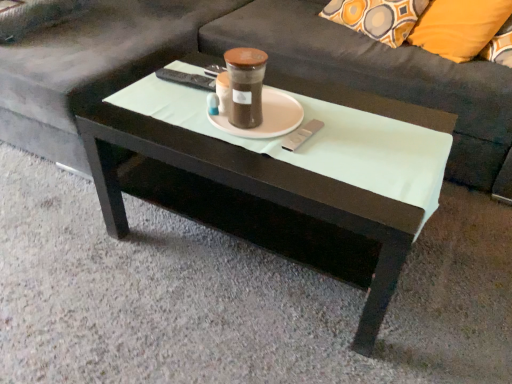
Question: Considering the positions of orange fabric pillow at upper right and white glossy coffee table at center in the image, is orange fabric pillow at upper right wider or thinner than white glossy coffee table at center?

Choices:
 (A) wide
 (B) thin

Answer: (B)

Question: In terms of height, does orange fabric pillow at upper right look taller or shorter compared to white glossy coffee table at center?

Choices:
 (A) tall
 (B) short

Answer: (B)

Question: Estimate the real-world distances between objects in this image. Which object is closer to the orange fabric pillow at upper right?

Choices:
 (A) brown matte glass jar at center
 (B) white glossy coffee table at center
 (C) dark gray fabric couch at center
 (D) white matte saucer at center

Answer: (C)

Question: Which object is the closest to the brown matte glass jar at center?

Choices:
 (A) dark gray fabric couch at center
 (B) white glossy coffee table at center
 (C) orange fabric pillow at upper right
 (D) white matte saucer at center

Answer: (D)